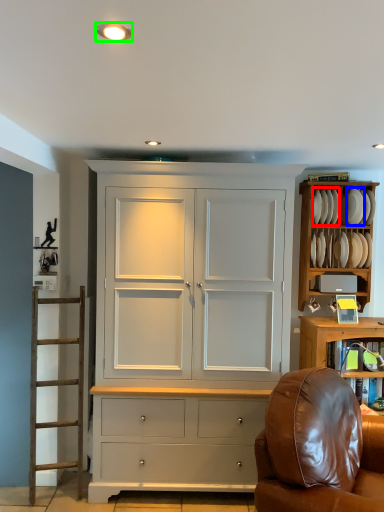
Question: Based on their relative distances, which object is nearer to plate (highlighted by a red box)? Choose from plate (highlighted by a blue box) and lighting (highlighted by a green box).

Choices:
 (A) plate
 (B) lighting

Answer: (A)